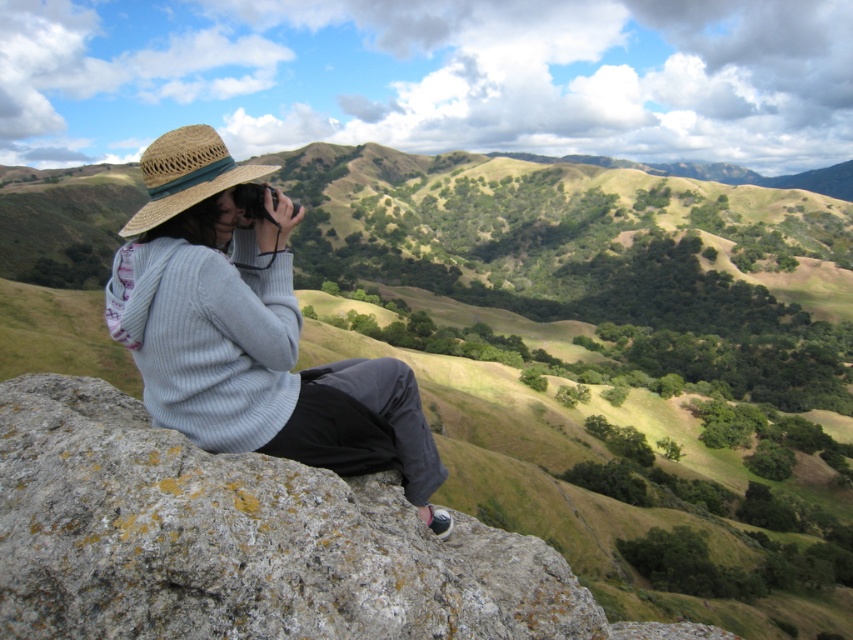
The height and width of the screenshot is (640, 853). What do you see at coordinates (248, 330) in the screenshot?
I see `straw hat at left` at bounding box center [248, 330].

Does straw hat at left have a greater width compared to strawmaterial/texturehat at left?

Incorrect, straw hat at left's width does not surpass strawmaterial/texturehat at left's.

Between point (234, 173) and point (167, 150), which one is positioned in front?

Positioned in front is point (167, 150).

Locate an element on the screen. straw hat at left is located at coordinates (248, 330).

Can you confirm if gray rough rock at center is wider than strawmaterial/texturehat at left?

No, gray rough rock at center is not wider than strawmaterial/texturehat at left.

This screenshot has width=853, height=640. What are the coordinates of `gray rough rock at center` in the screenshot? It's located at 238,540.

The width and height of the screenshot is (853, 640). I want to click on gray rough rock at center, so click(x=238, y=540).

Is gray rough rock at center taller than straw hat at left?

Yes.

Which is behind, point (244, 596) or point (148, 305)?

The point (148, 305) is behind.

Who is more distant from viewer, (x=537, y=586) or (x=210, y=308)?

The point (x=537, y=586) is behind.

Where is `gray rough rock at center`? This screenshot has height=640, width=853. gray rough rock at center is located at coordinates (238, 540).